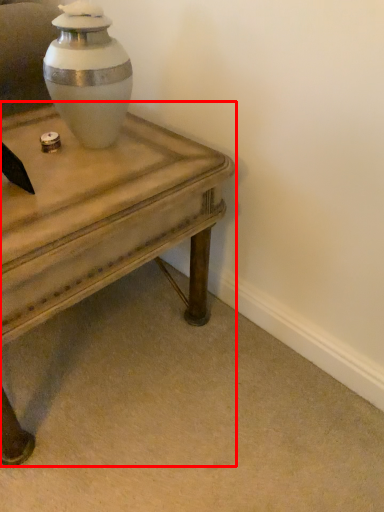
Question: From the image's perspective, what is the correct spatial relationship of table (annotated by the red box) in relation to vase?

Choices:
 (A) above
 (B) below

Answer: (B)